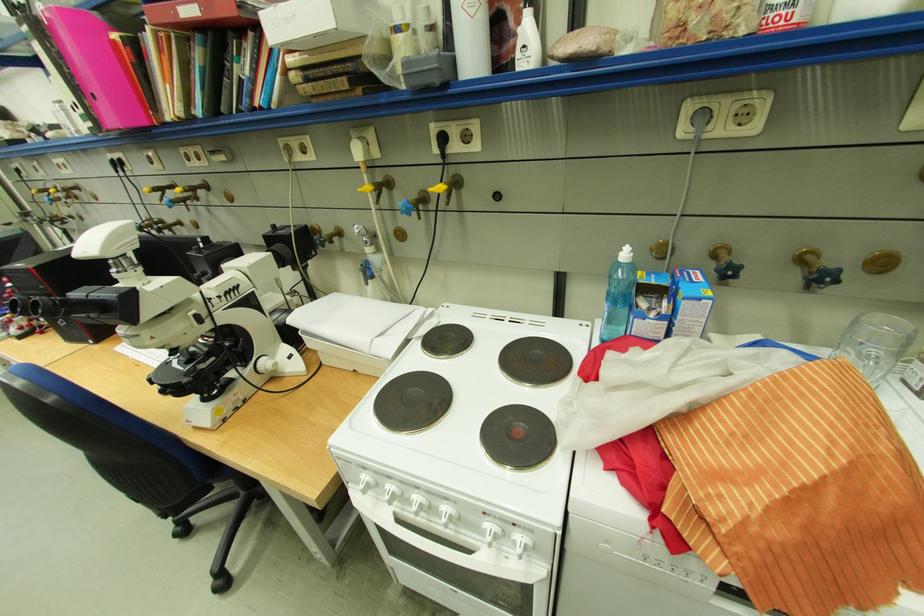
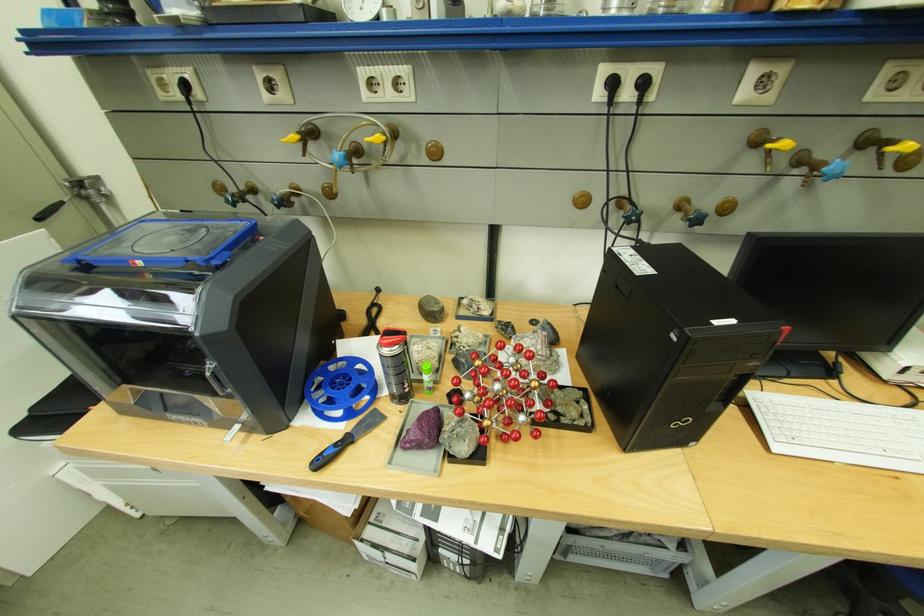
The point at (130, 168) is marked in the first image. Where is the corresponding point in the second image?

(638, 95)